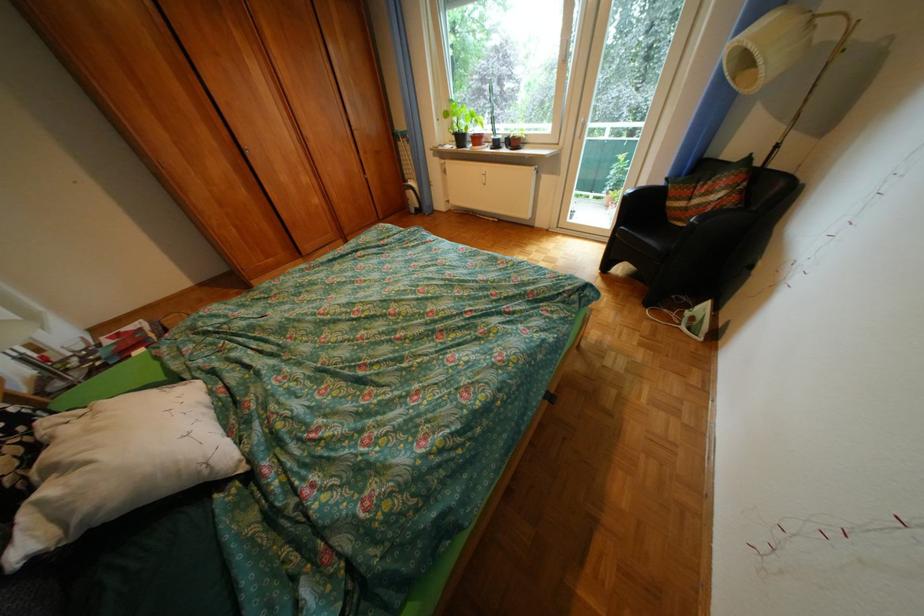
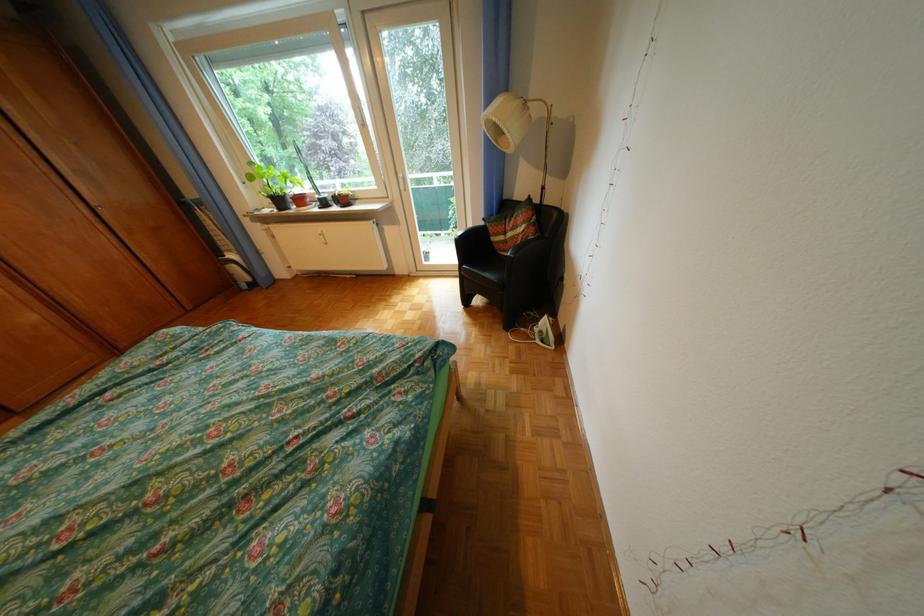
In the second image, find the point that corresponds to point 606,196 in the first image.

(457, 233)